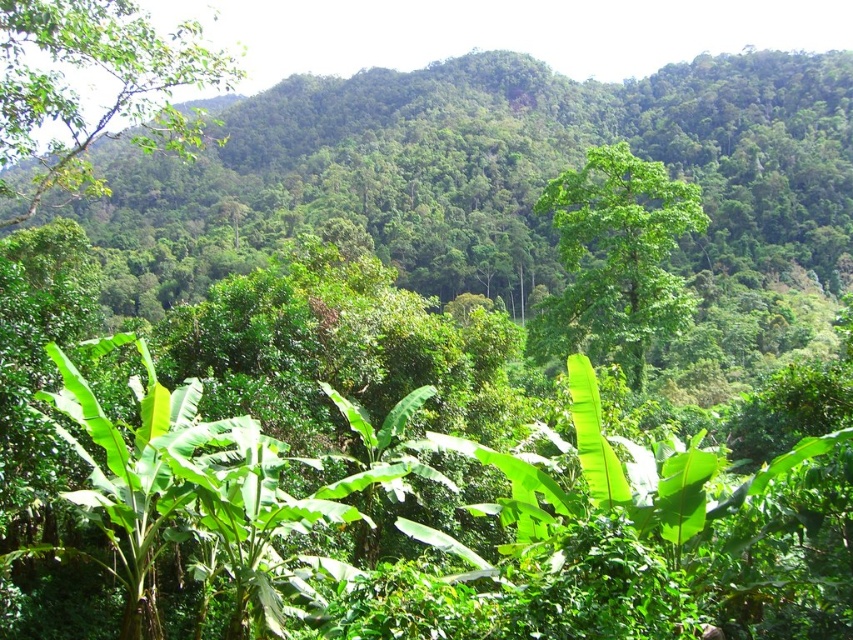
Based on the scene description, where is the green leafy tree at upper left located in terms of its 2D coordinates?

The green leafy tree at upper left is located at the 2D coordinates of point (79, 93).

You are standing in the lush landscape and see a point marked at coordinates (79, 93). Which object in the scene does this point correspond to?

The point at coordinates (79, 93) corresponds to the green leafy tree at upper left.

You are a botanist studying the spatial distribution of plants in this tropical landscape. You have a map with coordinates where the bottom left corner is the origin point. Where is the green leafy tree at center located on the map?

The green leafy tree at center is located at coordinates point (614,259) on the map.